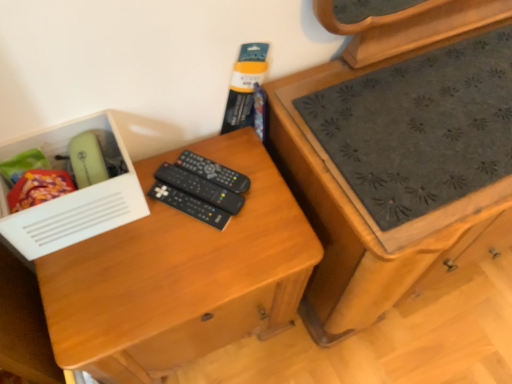
This screenshot has height=384, width=512. In order to click on free space that is to the left of black plastic remote controls at center, the second remote control positioned from the bottom in this screenshot , I will do `click(128, 219)`.